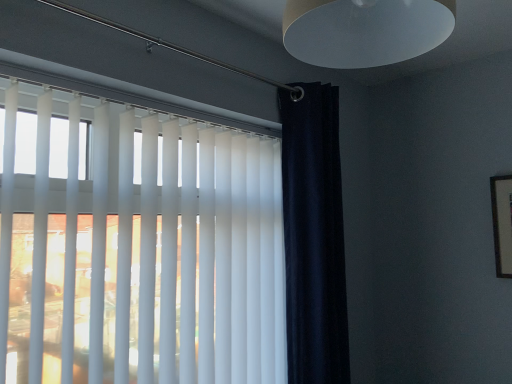
Question: Is white matte blinds at upper left directly adjacent to matte white lampshade at upper center?

Choices:
 (A) yes
 (B) no

Answer: (B)

Question: From a real-world perspective, does white matte blinds at upper left sit lower than matte white lampshade at upper center?

Choices:
 (A) yes
 (B) no

Answer: (A)

Question: Is white matte blinds at upper left at the left side of matte white lampshade at upper center?

Choices:
 (A) yes
 (B) no

Answer: (A)

Question: From a real-world perspective, is white matte blinds at upper left on matte white lampshade at upper center?

Choices:
 (A) yes
 (B) no

Answer: (B)

Question: Considering the relative sizes of white matte blinds at upper left and matte white lampshade at upper center in the image provided, is white matte blinds at upper left wider than matte white lampshade at upper center?

Choices:
 (A) yes
 (B) no

Answer: (B)

Question: Is matte white lampshade at upper center at the back of white matte blinds at upper left?

Choices:
 (A) no
 (B) yes

Answer: (A)

Question: Can you confirm if matte white lampshade at upper center is shorter than white matte blinds at upper left?

Choices:
 (A) yes
 (B) no

Answer: (A)

Question: Is matte white lampshade at upper center positioned with its back to white matte blinds at upper left?

Choices:
 (A) no
 (B) yes

Answer: (A)

Question: Are matte white lampshade at upper center and white matte blinds at upper left beside each other?

Choices:
 (A) yes
 (B) no

Answer: (B)

Question: Is matte white lampshade at upper center bigger than white matte blinds at upper left?

Choices:
 (A) yes
 (B) no

Answer: (B)

Question: Could you tell me if matte white lampshade at upper center is turned towards white matte blinds at upper left?

Choices:
 (A) no
 (B) yes

Answer: (A)

Question: From the image's perspective, is matte white lampshade at upper center under white matte blinds at upper left?

Choices:
 (A) no
 (B) yes

Answer: (A)

Question: From a real-world perspective, is navy blue velvet curtain at right located higher than matte white lampshade at upper center?

Choices:
 (A) yes
 (B) no

Answer: (B)